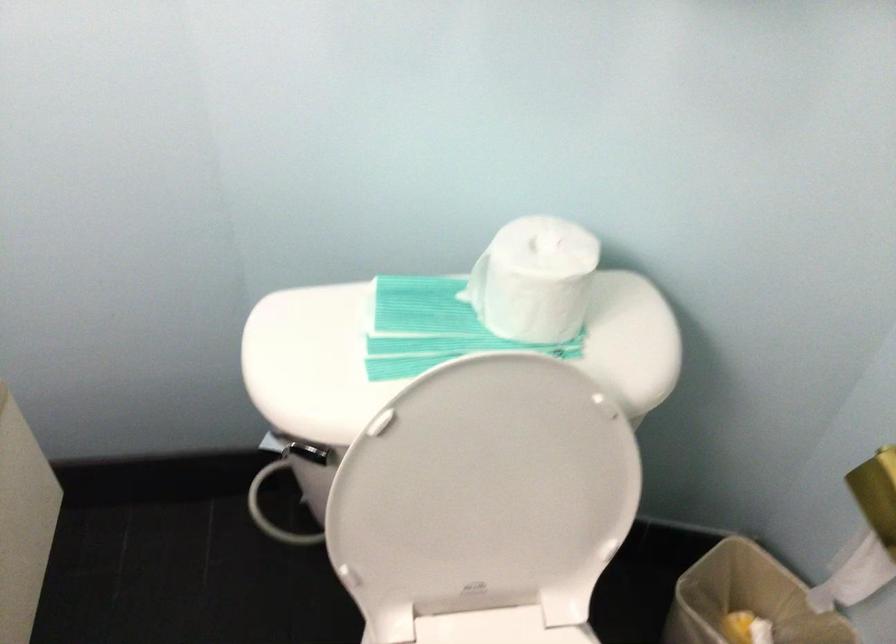
At what (x,y) coordinates should I click in order to perform the action: click on green paper towel. Please return your answer as a coordinate pair (x, y). The width and height of the screenshot is (896, 644). Looking at the image, I should click on (415, 308).